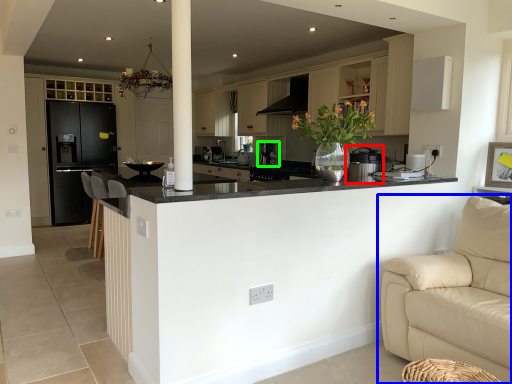
Question: Which is nearer to the appliance (highlighted by a red box)? studio couch (highlighted by a blue box) or coffee machine (highlighted by a green box).

Choices:
 (A) studio couch
 (B) coffee machine

Answer: (A)